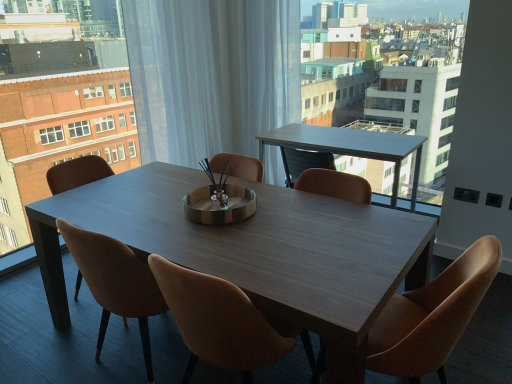
Question: Considering the relative sizes of leather at center, placed as the 1th chair when sorted from right to left, and brown leather chair at center, marked as the second chair in a right-to-left arrangement, in the image provided, is leather at center, placed as the 1th chair when sorted from right to left, bigger than brown leather chair at center, marked as the second chair in a right-to-left arrangement,?

Choices:
 (A) yes
 (B) no

Answer: (A)

Question: Is there a large distance between leather at center, placed as the 1th chair when sorted from right to left, and brown leather chair at center, which is counted as the 2th chair, starting from the left?

Choices:
 (A) no
 (B) yes

Answer: (A)

Question: From the image's perspective, does leather at center, which is the third chair in left-to-right order, appear higher than brown leather chair at center, which is counted as the 2th chair, starting from the left?

Choices:
 (A) no
 (B) yes

Answer: (B)

Question: Is the depth of leather at center, placed as the 1th chair when sorted from right to left, less than that of brown leather chair at center, which is counted as the 2th chair, starting from the left?

Choices:
 (A) no
 (B) yes

Answer: (B)

Question: Does leather at center, which is the third chair in left-to-right order, have a greater width compared to brown leather chair at center, which is counted as the 2th chair, starting from the left?

Choices:
 (A) yes
 (B) no

Answer: (A)

Question: Choose the correct answer: Is smooth white table at upper right, the first condominium when ordered from right to left, inside brown leather chair at center, the 1th chair from the left, or outside it?

Choices:
 (A) outside
 (B) inside

Answer: (A)

Question: Is smooth white table at upper right, the second condominium when ordered from left to right, in front of or behind brown leather chair at center, the 3th chair positioned from the right, in the image?

Choices:
 (A) behind
 (B) front

Answer: (A)

Question: Looking at their shapes, would you say smooth white table at upper right, the second condominium when ordered from left to right, is wider or thinner than brown leather chair at center, the 3th chair positioned from the right?

Choices:
 (A) wide
 (B) thin

Answer: (B)

Question: From a real-world perspective, is smooth white table at upper right, the second condominium when ordered from left to right, positioned above or below brown leather chair at center, the 3th chair positioned from the right?

Choices:
 (A) above
 (B) below

Answer: (A)

Question: Based on their positions, is leather at center, placed as the 1th chair when sorted from right to left, located to the left or right of light brown wooden table at upper center?

Choices:
 (A) right
 (B) left

Answer: (A)

Question: Is point (449, 269) positioned closer to the camera than point (416, 160)?

Choices:
 (A) closer
 (B) farther

Answer: (A)

Question: From the image's perspective, is leather at center, placed as the 1th chair when sorted from right to left, above or below light brown wooden table at upper center?

Choices:
 (A) above
 (B) below

Answer: (B)

Question: Considering the positions of leather at center, placed as the 1th chair when sorted from right to left, and light brown wooden table at upper center in the image, is leather at center, placed as the 1th chair when sorted from right to left, taller or shorter than light brown wooden table at upper center?

Choices:
 (A) tall
 (B) short

Answer: (A)

Question: Considering the positions of brown leather chair at center, which is counted as the 2th chair, starting from the left, and leather at center, which is the third chair in left-to-right order, in the image, is brown leather chair at center, which is counted as the 2th chair, starting from the left, wider or thinner than leather at center, which is the third chair in left-to-right order,?

Choices:
 (A) wide
 (B) thin

Answer: (B)

Question: Choose the correct answer: Is brown leather chair at center, marked as the second chair in a right-to-left arrangement, inside leather at center, which is the third chair in left-to-right order, or outside it?

Choices:
 (A) inside
 (B) outside

Answer: (B)